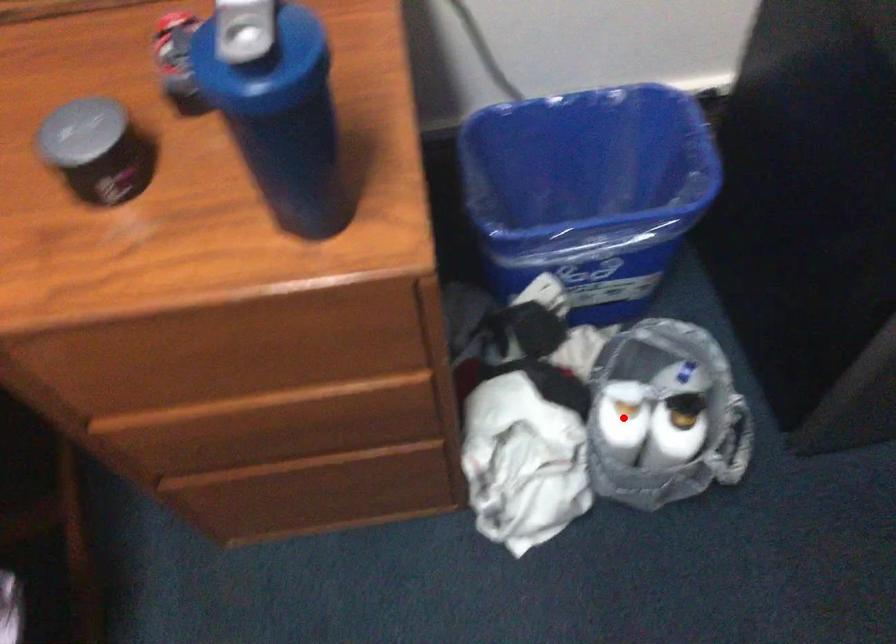
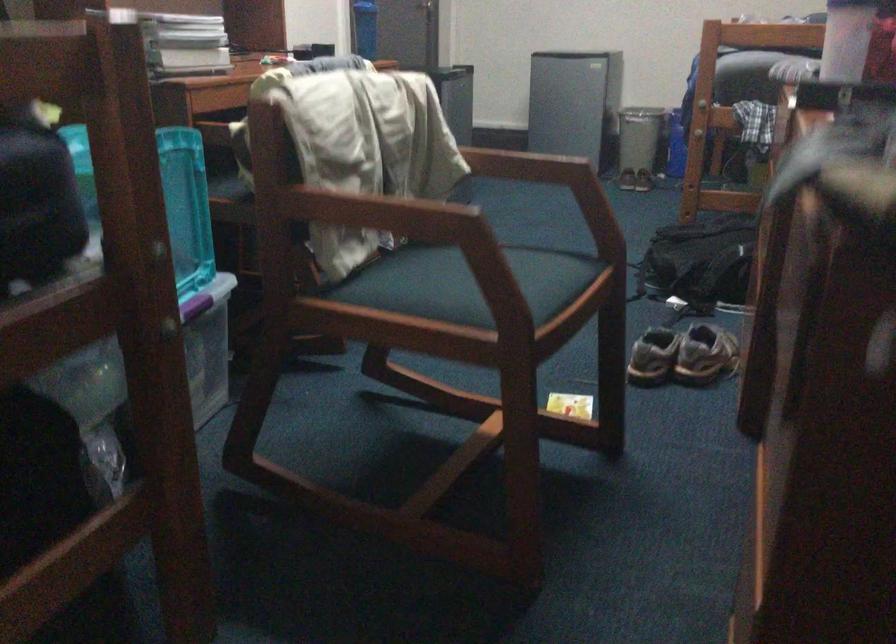
Question: I am providing you with two images of the same scene from different viewpoints. A red point is marked on the first image. At the location where the point appears in image 1, is it still visible in image 2?

Choices:
 (A) Yes
 (B) No

Answer: (B)